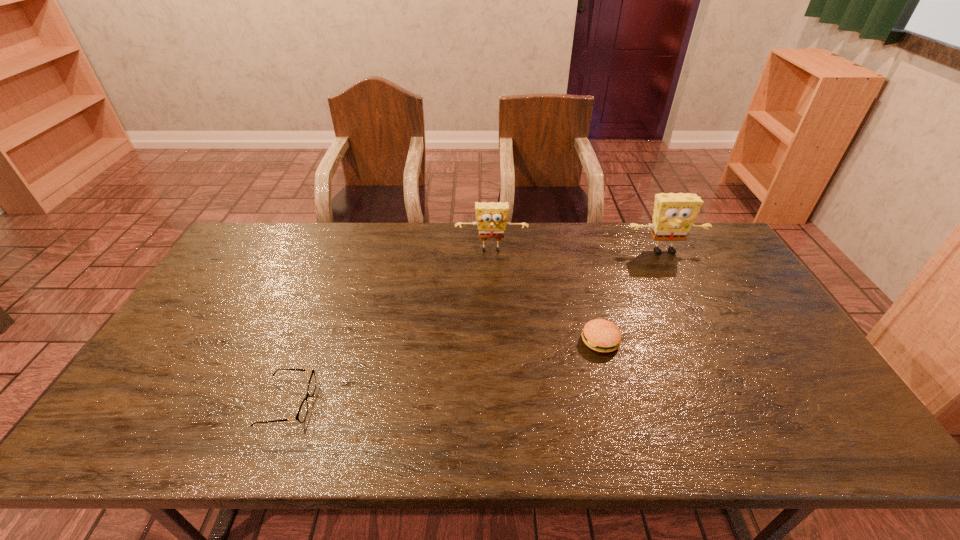
Locate an element on the screen. The width and height of the screenshot is (960, 540). object that stands as the third closest to the spectacles is located at coordinates (674, 214).

At what (x,y) coordinates should I click in order to perform the action: click on object that stands as the closest to the nearest object. Please return your answer as a coordinate pair (x, y). Looking at the image, I should click on (491, 217).

Locate an element on the screen. free space that satisfies the following two spatial constraints: 1. on the face of the second tallest object; 2. on the front-facing side of the spectacles is located at coordinates (496, 403).

Where is `vacant region that satisfies the following two spatial constraints: 1. on the face of the right sponge; 2. on the front-facing side of the shortest object`? vacant region that satisfies the following two spatial constraints: 1. on the face of the right sponge; 2. on the front-facing side of the shortest object is located at coordinates (742, 403).

I want to click on free region that satisfies the following two spatial constraints: 1. on the face of the second object from left to right; 2. on the right side of the patty, so click(x=494, y=341).

You are a GUI agent. You are given a task and a screenshot of the screen. Output one action in this format:
    pyautogui.click(x=<x>, y=<y>)
    Task: Click on the vacant space that satisfies the following two spatial constraints: 1. on the face of the right sponge; 2. on the front-facing side of the leftmost object
    
    Given the screenshot: What is the action you would take?
    pyautogui.click(x=742, y=403)

The width and height of the screenshot is (960, 540). What are the coordinates of `vacant area in the image that satisfies the following two spatial constraints: 1. on the face of the tallest object; 2. on the front-facing side of the leftmost object` in the screenshot? It's located at (742, 403).